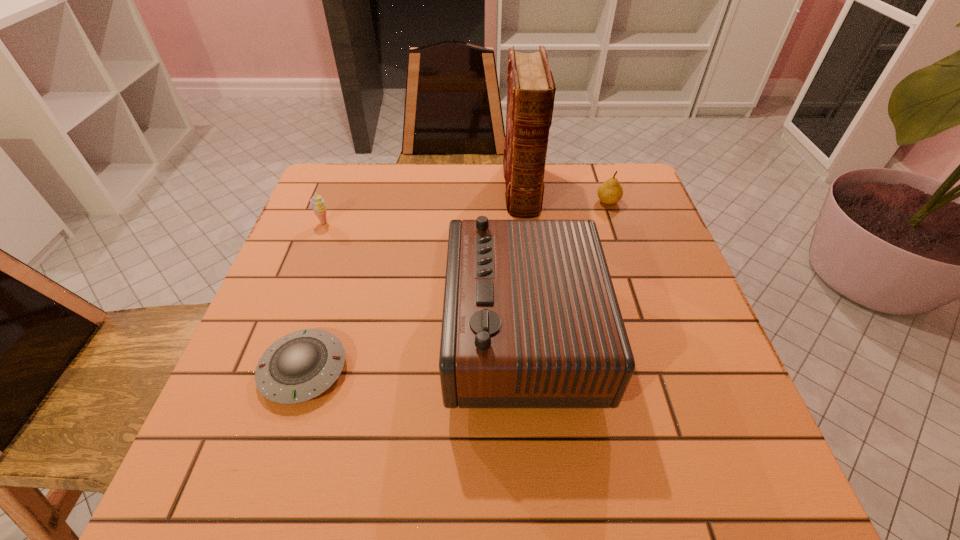
The height and width of the screenshot is (540, 960). In the image, there is a desktop. Identify the location of free space at the right edge. (684, 314).

The image size is (960, 540). I want to click on free space at the far left corner, so click(337, 176).

This screenshot has height=540, width=960. Find the location of `vacant space at the far right corner`. vacant space at the far right corner is located at coordinates (639, 210).

Where is `free space between the hardback book and the pear`? This screenshot has width=960, height=540. free space between the hardback book and the pear is located at coordinates (564, 195).

I want to click on unoccupied area between the sherbert and the shortest object, so click(314, 296).

Find the location of `free space between the pear and the sherbert`. free space between the pear and the sherbert is located at coordinates (466, 212).

This screenshot has width=960, height=540. What are the coordinates of `vacant region between the rightmost object and the sherbert` in the screenshot? It's located at (466, 212).

At what (x,y) coordinates should I click in order to perform the action: click on empty space between the sherbert and the shortest object. Please return your answer as a coordinate pair (x, y). Image resolution: width=960 pixels, height=540 pixels. Looking at the image, I should click on (314, 296).

Find the location of `free spot between the sherbert and the shortest object`. free spot between the sherbert and the shortest object is located at coordinates (314, 296).

The width and height of the screenshot is (960, 540). Identify the location of the closest object to the rightmost object. (531, 89).